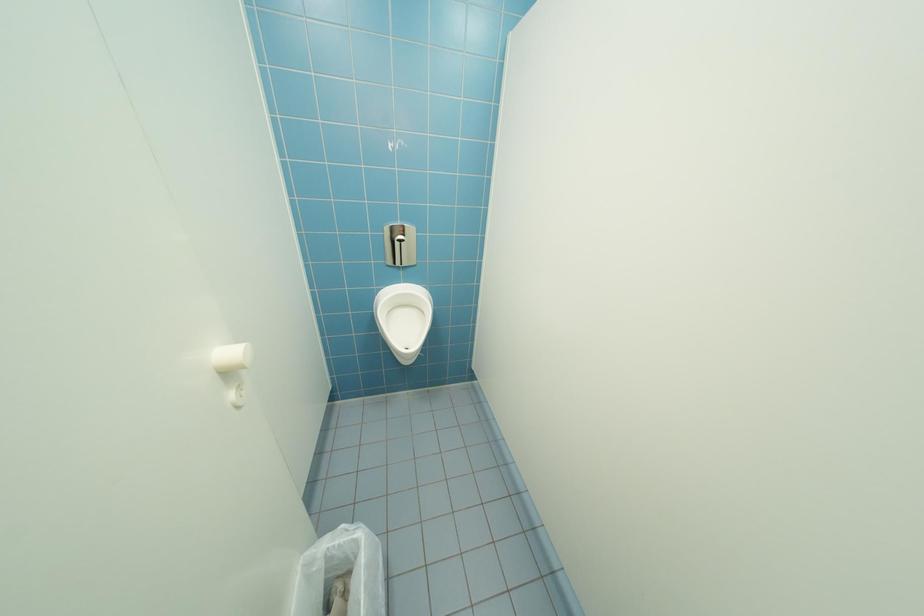
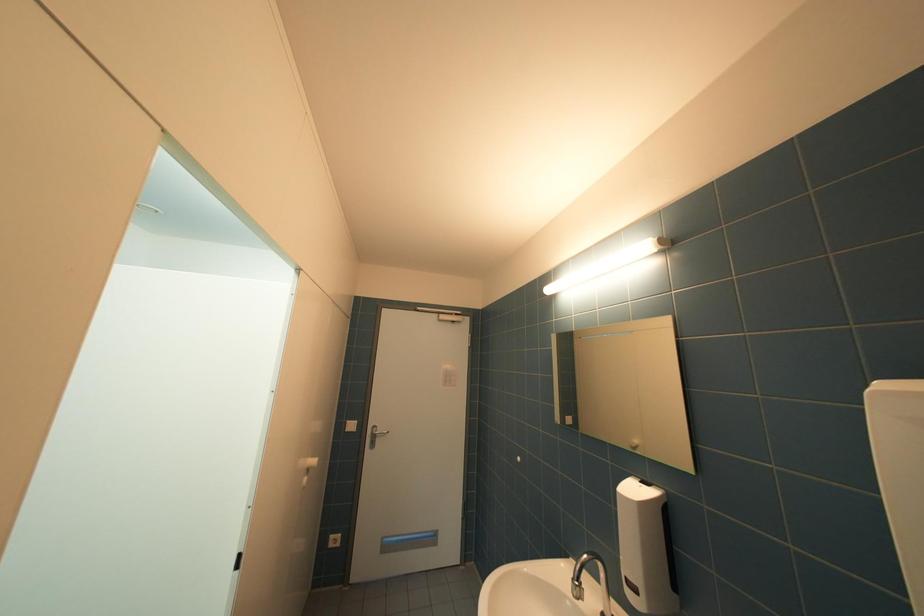
Question: How did the camera likely rotate?

Choices:
 (A) Left
 (B) Right
 (C) Up
 (D) Down

Answer: (B)